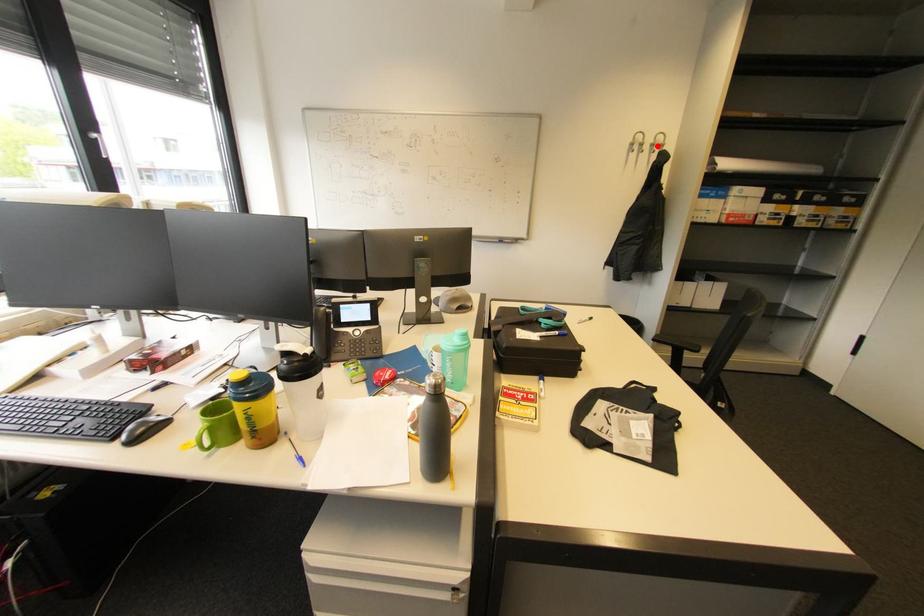
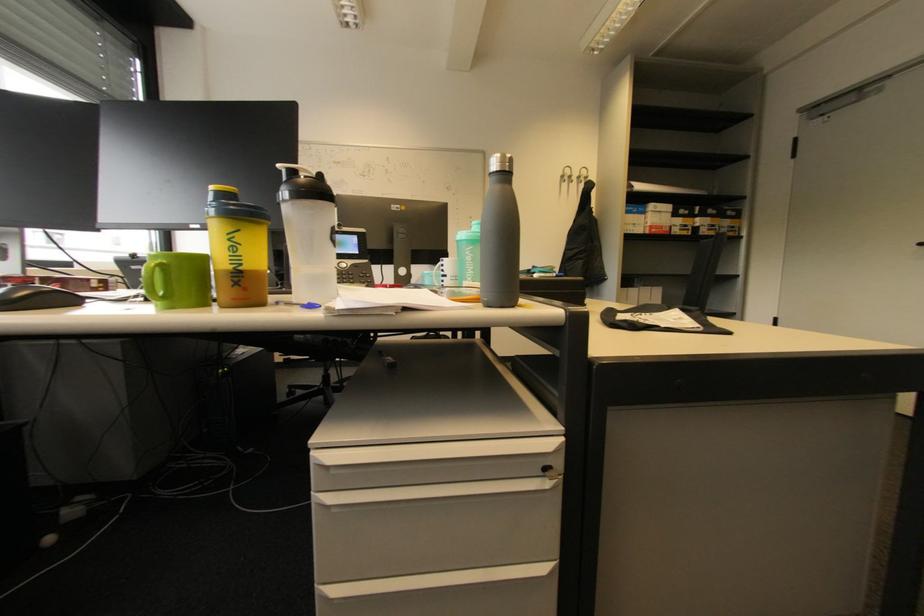
The point at the highlighted location is marked in the first image. Where is the corresponding point in the second image?

(584, 177)